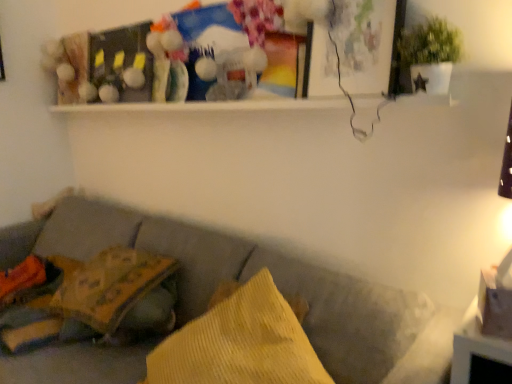
Question: Is yellow corduroy pillow at lower left, marked as the first pillow in a left-to-right arrangement, positioned beyond the bounds of yellow corduroy pillow at center, the 1th pillow when ordered from right to left?

Choices:
 (A) yes
 (B) no

Answer: (A)

Question: Is yellow corduroy pillow at lower left, acting as the 1th pillow starting from the back, smaller than yellow corduroy pillow at center, the 1th pillow when ordered from right to left?

Choices:
 (A) no
 (B) yes

Answer: (B)

Question: Is yellow corduroy pillow at lower left, arranged as the second pillow when viewed from the front, closer to the viewer compared to yellow corduroy pillow at center, the 1th pillow when ordered from right to left?

Choices:
 (A) yes
 (B) no

Answer: (B)

Question: Is yellow corduroy pillow at lower left, marked as the first pillow in a left-to-right arrangement, looking in the opposite direction of yellow corduroy pillow at center, which appears as the first pillow when viewed from the front?

Choices:
 (A) yes
 (B) no

Answer: (B)

Question: Is yellow corduroy pillow at lower left, acting as the 1th pillow starting from the back, at the left side of yellow corduroy pillow at center, acting as the second pillow starting from the back?

Choices:
 (A) yes
 (B) no

Answer: (A)

Question: Based on their positions, is yellow corduroy pillow at center, the 2th pillow when ordered from left to right, located to the left or right of green matte plant at upper right?

Choices:
 (A) left
 (B) right

Answer: (A)

Question: Based on their sizes in the image, would you say yellow corduroy pillow at center, the 2th pillow when ordered from left to right, is bigger or smaller than green matte plant at upper right?

Choices:
 (A) small
 (B) big

Answer: (B)

Question: From a real-world perspective, is yellow corduroy pillow at center, the 1th pillow when ordered from right to left, physically located above or below green matte plant at upper right?

Choices:
 (A) above
 (B) below

Answer: (B)

Question: Is yellow corduroy pillow at center, which appears as the first pillow when viewed from the front, wider or thinner than green matte plant at upper right?

Choices:
 (A) wide
 (B) thin

Answer: (A)

Question: Considering the positions of green matte plant at upper right and yellow corduroy pillow at lower left, which appears as the 2th pillow when viewed from the right, in the image, is green matte plant at upper right wider or thinner than yellow corduroy pillow at lower left, which appears as the 2th pillow when viewed from the right,?

Choices:
 (A) thin
 (B) wide

Answer: (A)

Question: Is green matte plant at upper right taller or shorter than yellow corduroy pillow at lower left, arranged as the second pillow when viewed from the front?

Choices:
 (A) tall
 (B) short

Answer: (A)

Question: Does point (426, 89) appear closer or farther from the camera than point (103, 326)?

Choices:
 (A) closer
 (B) farther

Answer: (A)

Question: Based on their positions, is green matte plant at upper right located to the left or right of yellow corduroy pillow at lower left, arranged as the second pillow when viewed from the front?

Choices:
 (A) right
 (B) left

Answer: (A)

Question: From a real-world perspective, relative to green matte plant at upper right, is textured gray couch at lower left vertically above or below?

Choices:
 (A) below
 (B) above

Answer: (A)

Question: Considering their positions, is textured gray couch at lower left located in front of or behind green matte plant at upper right?

Choices:
 (A) front
 (B) behind

Answer: (A)